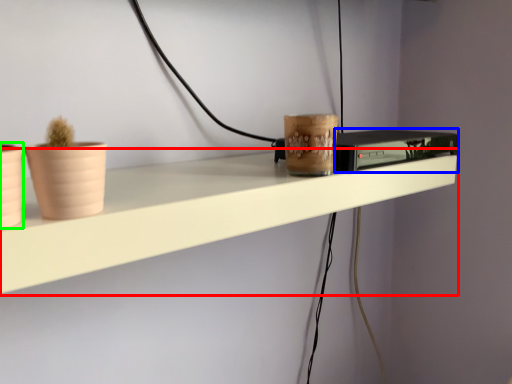
Question: Estimate the real-world distances between objects in this image. Which object is farther from shelf (highlighted by a red box), appliance (highlighted by a blue box) or flowerpot (highlighted by a green box)?

Choices:
 (A) appliance
 (B) flowerpot

Answer: (B)